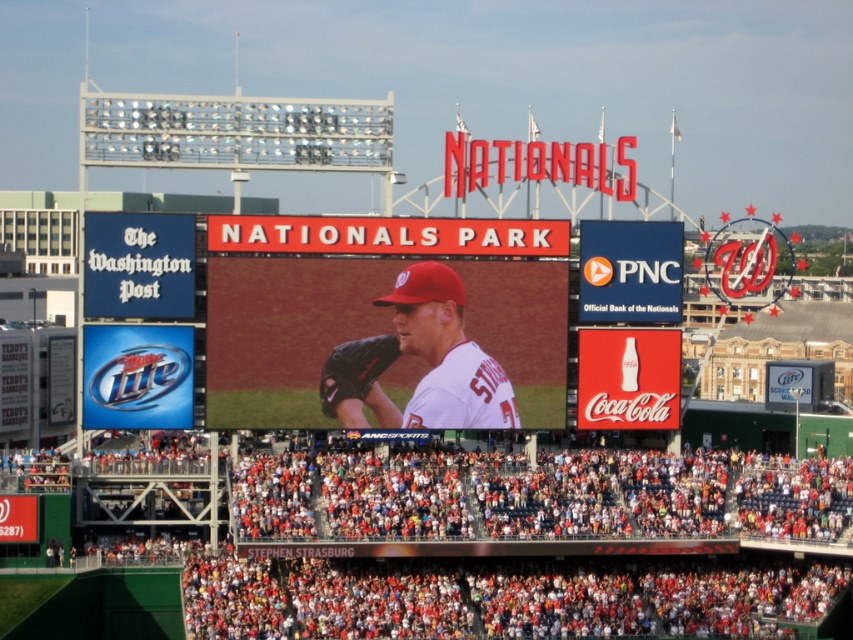
Question: Does white matte baseball uniform at center appear under black leather glove at center?

Choices:
 (A) no
 (B) yes

Answer: (A)

Question: Is white matte baseball uniform at center positioned behind black leather glove at center?

Choices:
 (A) no
 (B) yes

Answer: (A)

Question: Which point is farther to the camera?

Choices:
 (A) (343, 392)
 (B) (833, 513)
 (C) (416, 248)
 (D) (364, 426)

Answer: (B)

Question: Which of the following is the closest to the observer?

Choices:
 (A) (346, 397)
 (B) (463, 342)
 (C) (486, 371)
 (D) (271, 605)

Answer: (D)

Question: Is red fabric crowd at lower center bigger than black leather glove at center?

Choices:
 (A) no
 (B) yes

Answer: (B)

Question: Which point appears farthest from the camera in this image?

Choices:
 (A) (351, 369)
 (B) (277, 317)
 (C) (640, 624)
 (D) (334, 356)

Answer: (A)